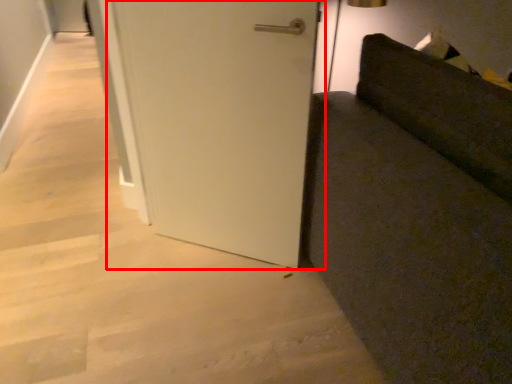
Question: From the image's perspective, where is door (annotated by the red box) located relative to furniture?

Choices:
 (A) below
 (B) above

Answer: (B)